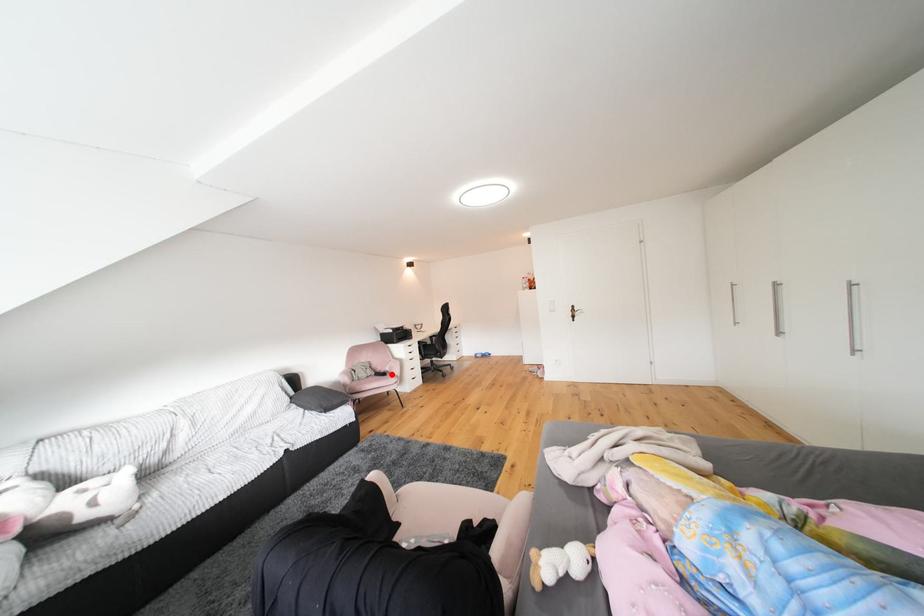
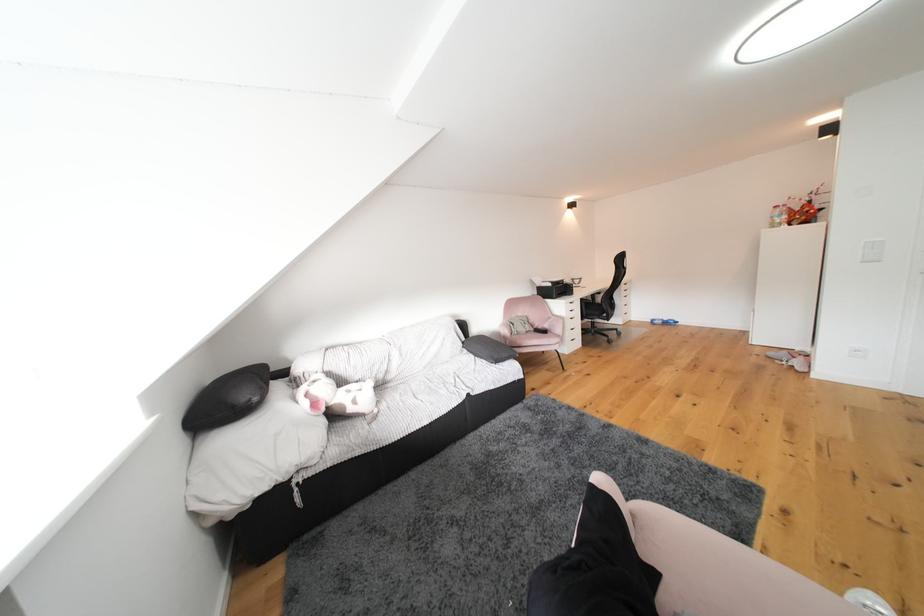
Locate, in the second image, the point that corresponds to the highlighted location in the first image.

(550, 331)